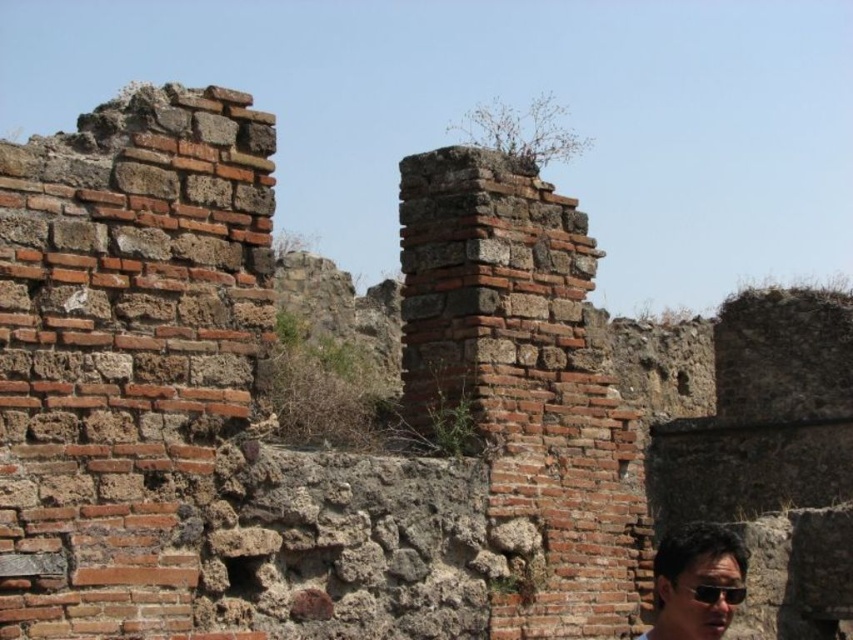
Question: Observing the image, what is the correct spatial positioning of matte black sunglasses at lower right in reference to black plastic goggles at lower right?

Choices:
 (A) below
 (B) above

Answer: (A)

Question: Considering the relative positions of matte black sunglasses at lower right and black plastic goggles at lower right in the image provided, where is matte black sunglasses at lower right located with respect to black plastic goggles at lower right?

Choices:
 (A) left
 (B) right

Answer: (B)

Question: Which point is closer to the camera?

Choices:
 (A) black plastic goggles at lower right
 (B) matte black sunglasses at lower right

Answer: (B)

Question: Among these points, which one is nearest to the camera?

Choices:
 (A) (670, 580)
 (B) (717, 627)

Answer: (B)

Question: Where is matte black sunglasses at lower right located in relation to black plastic goggles at lower right in the image?

Choices:
 (A) below
 (B) above

Answer: (A)